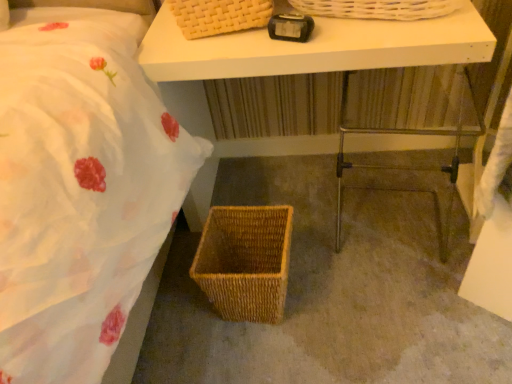
Question: Is woven brown picnic basket at lower center smaller than brown woven basket at lower center?

Choices:
 (A) yes
 (B) no

Answer: (A)

Question: Is woven brown picnic basket at lower center at the left side of brown woven basket at lower center?

Choices:
 (A) no
 (B) yes

Answer: (B)

Question: Is woven brown picnic basket at lower center shorter than brown woven basket at lower center?

Choices:
 (A) no
 (B) yes

Answer: (A)

Question: Is woven brown picnic basket at lower center turned away from brown woven basket at lower center?

Choices:
 (A) yes
 (B) no

Answer: (B)

Question: From the image's perspective, does woven brown picnic basket at lower center appear higher than brown woven basket at lower center?

Choices:
 (A) yes
 (B) no

Answer: (B)

Question: Can you confirm if woven brown picnic basket at lower center is positioned to the right of brown woven basket at lower center?

Choices:
 (A) no
 (B) yes

Answer: (A)

Question: Considering the relative positions of woven brown picnic basket at lower center and black plastic alarm clock at upper center in the image provided, is woven brown picnic basket at lower center to the right of black plastic alarm clock at upper center from the viewer's perspective?

Choices:
 (A) yes
 (B) no

Answer: (B)

Question: Does woven brown picnic basket at lower center have a greater width compared to black plastic alarm clock at upper center?

Choices:
 (A) no
 (B) yes

Answer: (B)

Question: Is woven brown picnic basket at lower center thinner than black plastic alarm clock at upper center?

Choices:
 (A) yes
 (B) no

Answer: (B)

Question: From the image's perspective, is woven brown picnic basket at lower center located above black plastic alarm clock at upper center?

Choices:
 (A) yes
 (B) no

Answer: (B)

Question: Does woven brown picnic basket at lower center come behind black plastic alarm clock at upper center?

Choices:
 (A) yes
 (B) no

Answer: (A)

Question: Considering the relative positions of woven brown picnic basket at lower center and black plastic alarm clock at upper center in the image provided, is woven brown picnic basket at lower center to the left of black plastic alarm clock at upper center from the viewer's perspective?

Choices:
 (A) no
 (B) yes

Answer: (B)

Question: From the image's perspective, is black plastic alarm clock at upper center under brown woven basket at lower center?

Choices:
 (A) no
 (B) yes

Answer: (A)